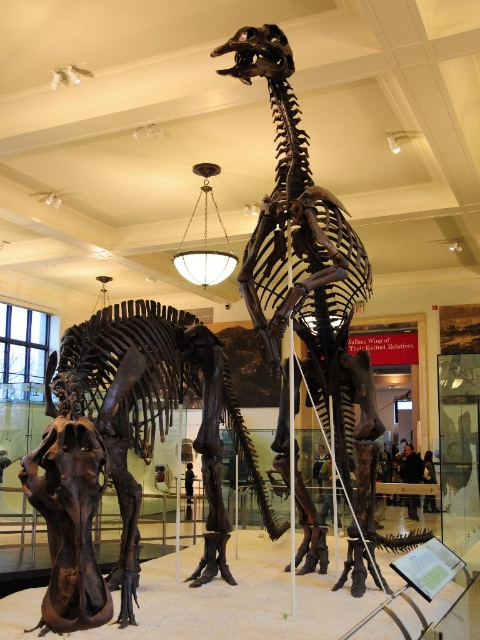
Between shiny brown dinosaur at center and brown bone dinosaur at center, which one is positioned higher?

brown bone dinosaur at center is above.

Is point (130, 308) positioned after point (273, 269)?

No.

Image resolution: width=480 pixels, height=640 pixels. I want to click on shiny brown dinosaur at center, so 126,449.